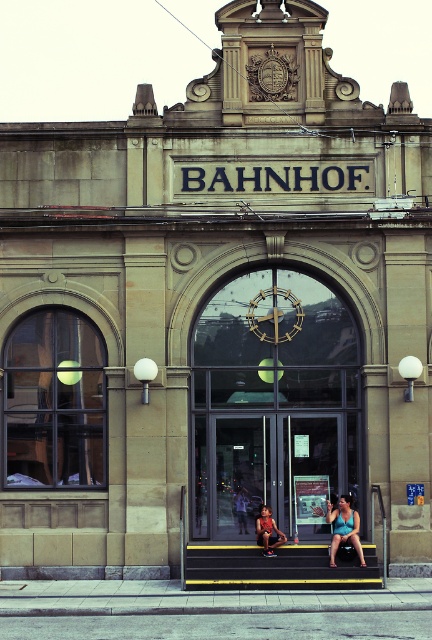
You are a tourist standing in front of the BAHNHOF train station. You notice the yellow painted stairs at center and the gold metallic clock at center. Which of these two objects appears larger in size?

The yellow painted stairs at center appears larger in size than the gold metallic clock at center.

You are standing in front of the BAHNHOF train station entrance. You notice the yellow painted stairs at center and the gold metallic clock at center. Which object is taller?

The gold metallic clock at center is taller than the yellow painted stairs at center.

From the picture: You are standing in front of the BAHNHOF train station and notice a matte blue tank top at center. According to the coordinates provided, where exactly would you look to find the matte blue tank top?

The matte blue tank top at center is located at point coordinates of (343, 528).